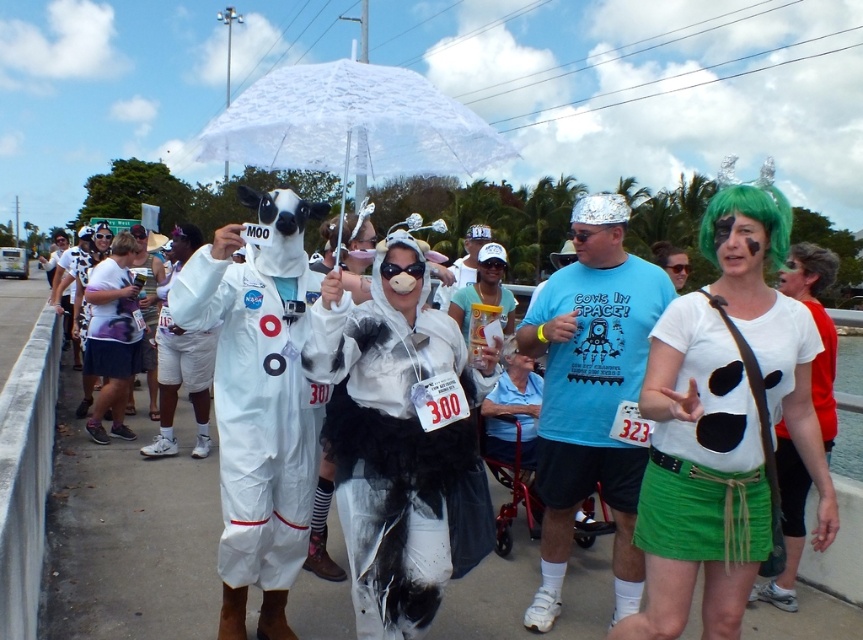
Question: Is white fabric astronaut suit at center wider than green synthetic wig at upper right?

Choices:
 (A) yes
 (B) no

Answer: (B)

Question: Which point is farther from the camera taking this photo?

Choices:
 (A) (356, 144)
 (B) (246, 307)
 (C) (735, 186)

Answer: (A)

Question: Observing the image, what is the correct spatial positioning of purple fabric bag at left in reference to green synthetic wig at upper right?

Choices:
 (A) left
 (B) right

Answer: (A)

Question: Which is farther from the white matte t-shirt at center?

Choices:
 (A) white matte cow costume at center
 (B) purple fabric bag at left
 (C) green synthetic wig at upper right
 (D) matte white shirt with cow print at center

Answer: (B)

Question: Based on their relative distances, which object is nearer to the white matte t-shirt at center?

Choices:
 (A) white matte cow costume at center
 (B) white lace umbrella at center
 (C) matte white shirt with cow print at center

Answer: (C)

Question: Considering the relative positions of matte white shirt with cow print at center and white matte cow costume at center in the image provided, where is matte white shirt with cow print at center located with respect to white matte cow costume at center?

Choices:
 (A) left
 (B) right

Answer: (B)